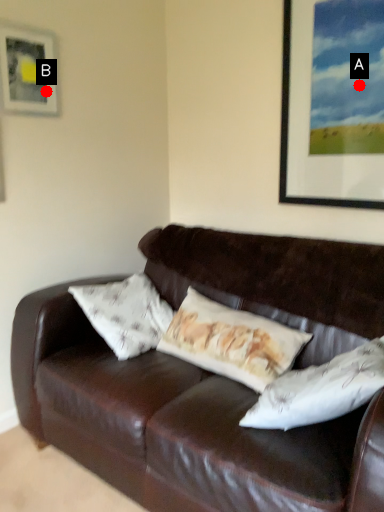
Question: Two points are circled on the image, labeled by A and B beside each circle. Among these points, which one is nearest to the camera?

Choices:
 (A) A is closer
 (B) B is closer

Answer: (A)